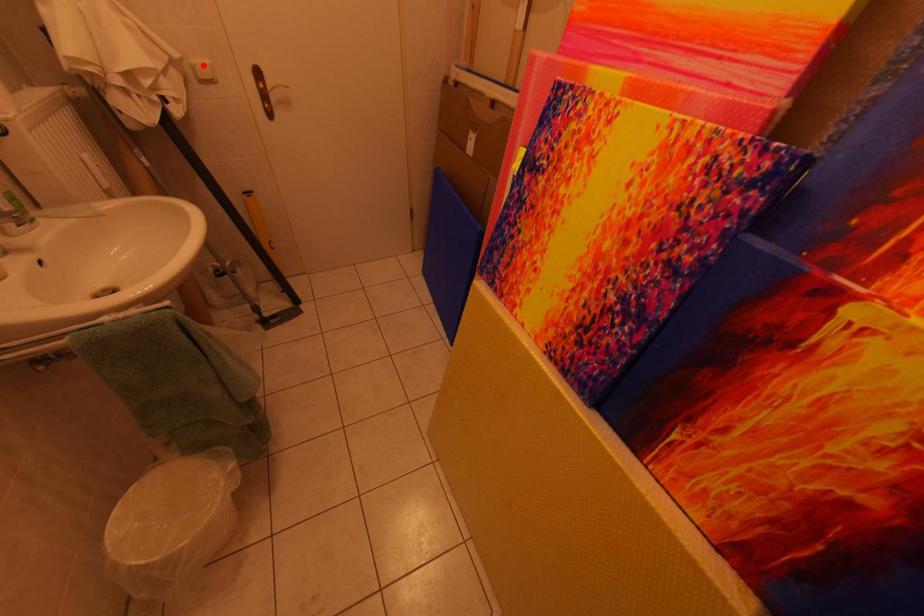
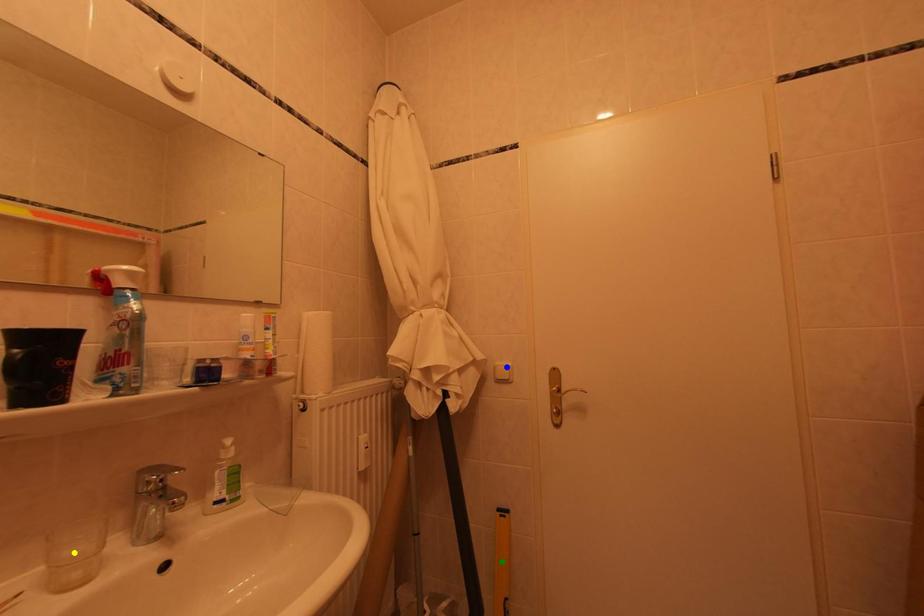
Question: I am providing you with two images of the same scene from different viewpoints. A red point is marked on the first image. You are given multiple points on the second image. In image 2, which mark is for the same physical point as the one in image 1?

Choices:
 (A) yellow point
 (B) blue point
 (C) green point

Answer: (B)